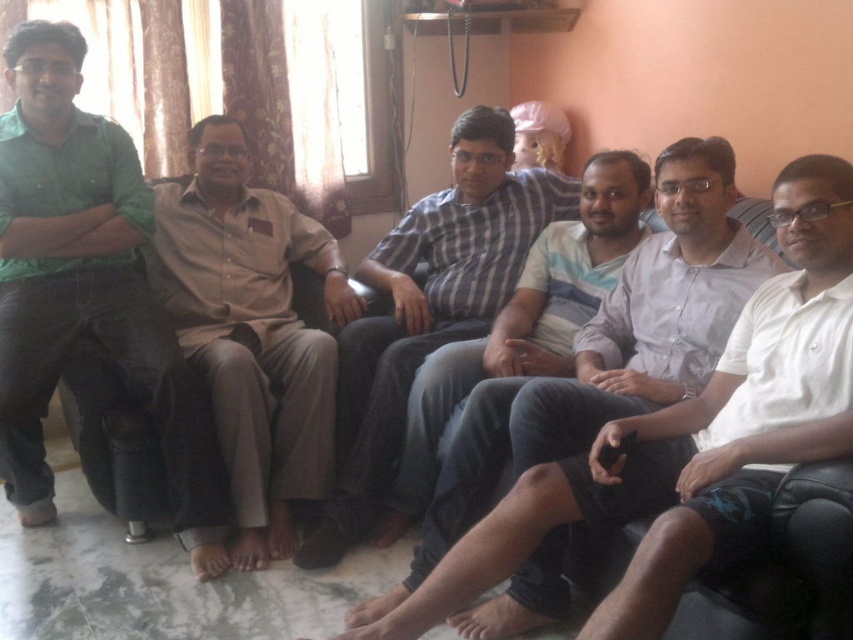
Question: Is green matte shirt at left in front of beige cotton shirt at center?

Choices:
 (A) no
 (B) yes

Answer: (B)

Question: Considering the real-world distances, which object is farthest from the green matte shirt at left?

Choices:
 (A) striped cotton shirt at center
 (B) beige cotton shirt at center

Answer: (A)

Question: Which of the following is the farthest from the observer?

Choices:
 (A) (296, 460)
 (B) (186, 404)

Answer: (A)

Question: Which point is farther from the camera taking this photo?

Choices:
 (A) (811, 282)
 (B) (573, 291)
 (C) (19, 513)
 (D) (325, 428)

Answer: (B)

Question: Can you confirm if white striped shirt at center is positioned below beige cotton shirt at center?

Choices:
 (A) yes
 (B) no

Answer: (A)

Question: Where is green matte shirt at left located in relation to beige cotton shirt at center in the image?

Choices:
 (A) below
 (B) above

Answer: (B)